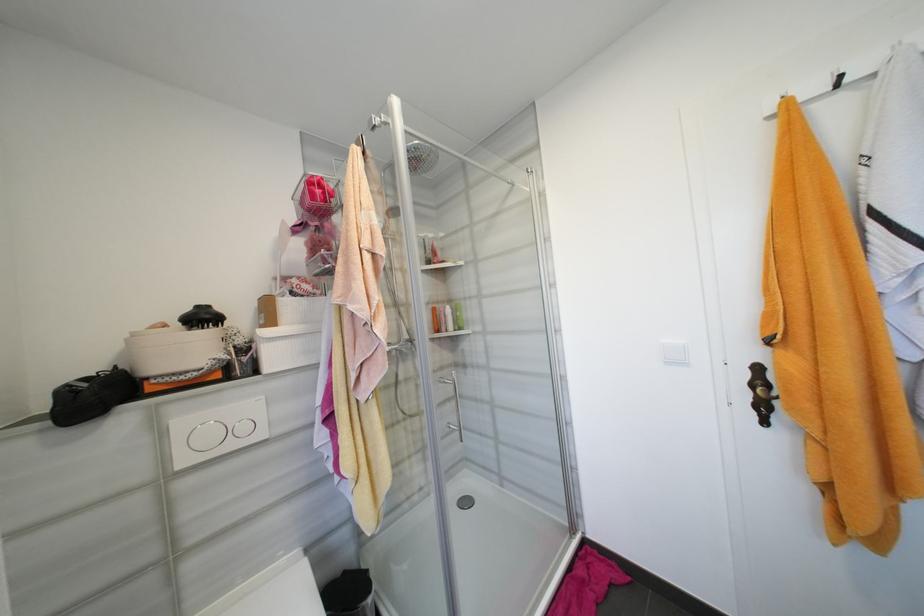
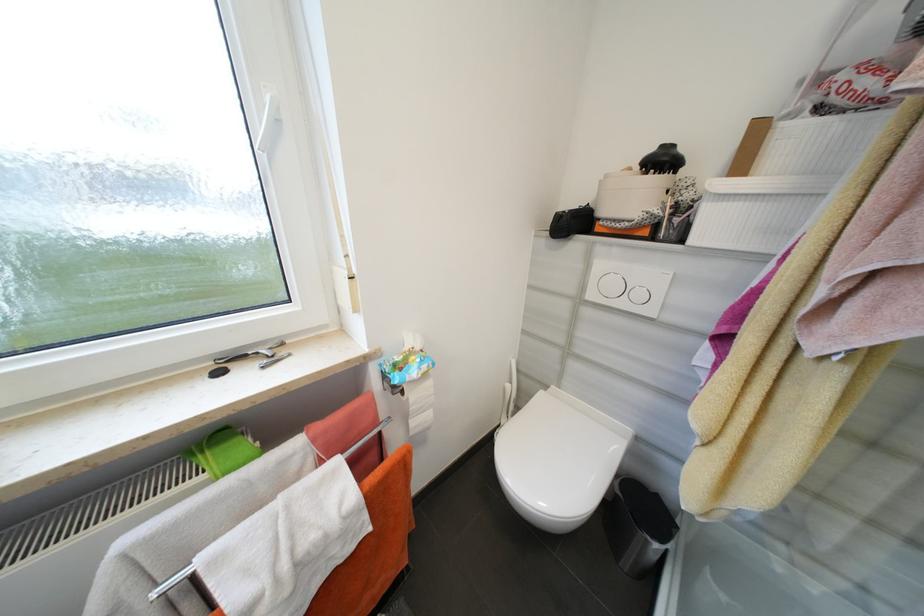
Locate, in the second image, the point that corresponds to the point at 249,429 in the first image.

(646, 296)